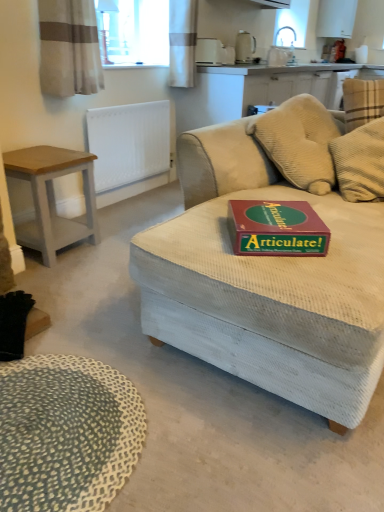
Where is `empty space that is ontop of white textured radiator at upper left (from a real-world perspective)`? This screenshot has width=384, height=512. empty space that is ontop of white textured radiator at upper left (from a real-world perspective) is located at coordinates (132, 101).